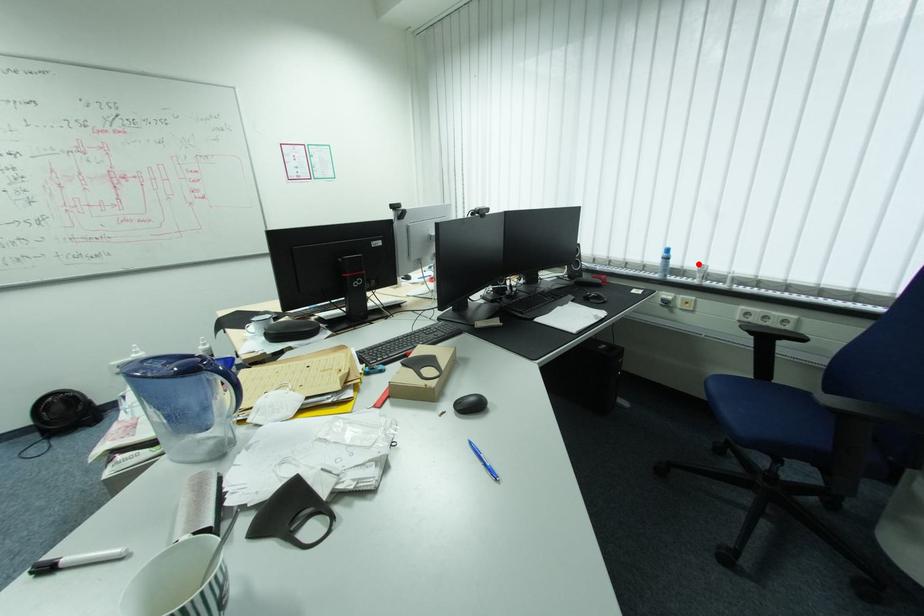
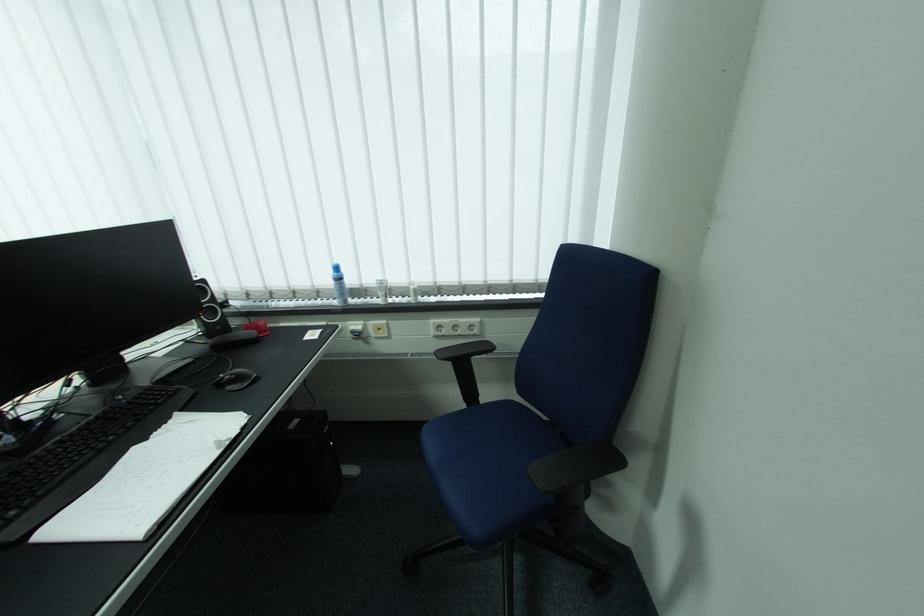
The point at the highlighted location is marked in the first image. Where is the corresponding point in the second image?

(377, 281)